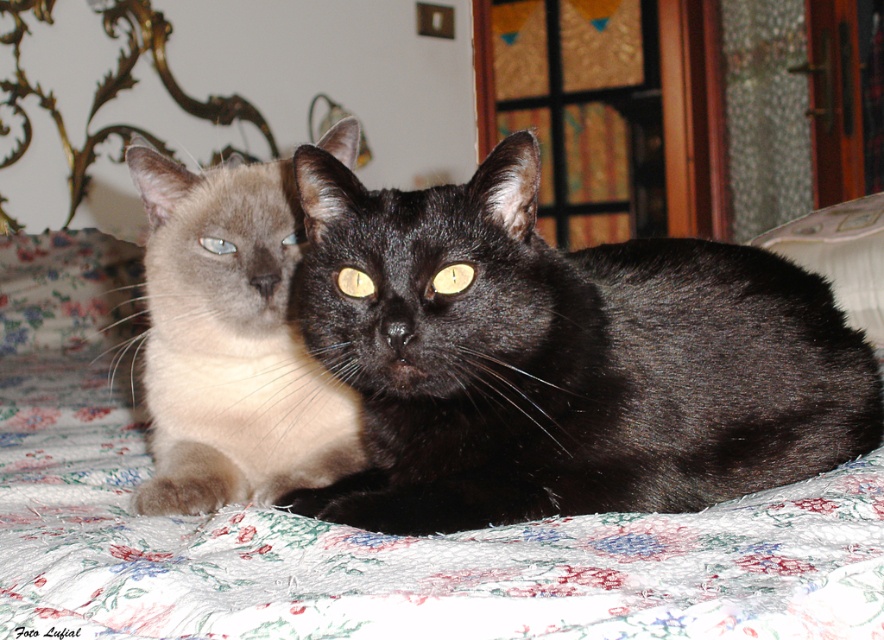
You are a GUI agent. You are given a task and a screenshot of the screen. Output one action in this format:
    pyautogui.click(x=<x>, y=<y>)
    Task: Click on the black glossy cat at center
    The height and width of the screenshot is (640, 884).
    Given the screenshot: What is the action you would take?
    pyautogui.click(x=560, y=358)

Is the position of black glossy cat at center more distant than that of matte cream cat at center?

No, it is not.

Is point (492, 252) positioned in front of point (202, 257)?

That is True.

In order to click on black glossy cat at center in this screenshot , I will do `click(560, 358)`.